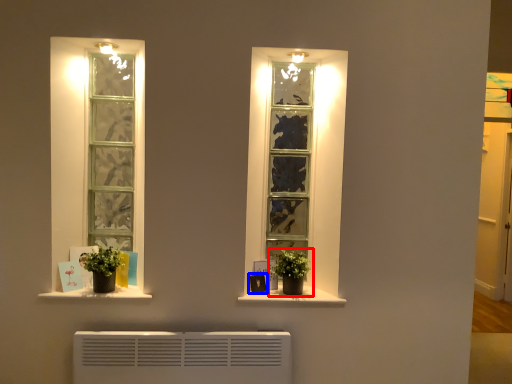
Question: Among these objects, which one is nearest to the camera, houseplant (highlighted by a red box) or picture frame (highlighted by a blue box)?

Choices:
 (A) houseplant
 (B) picture frame

Answer: (A)